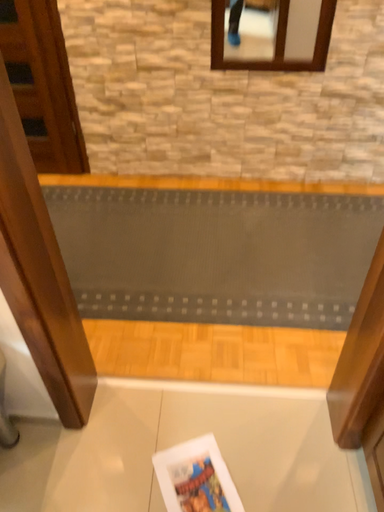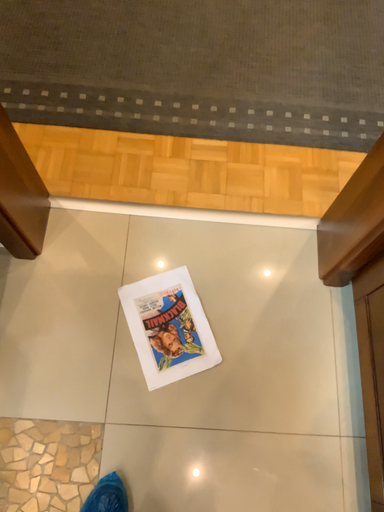
Question: Which way did the camera rotate in the video?

Choices:
 (A) rotated downward
 (B) rotated upward

Answer: (A)